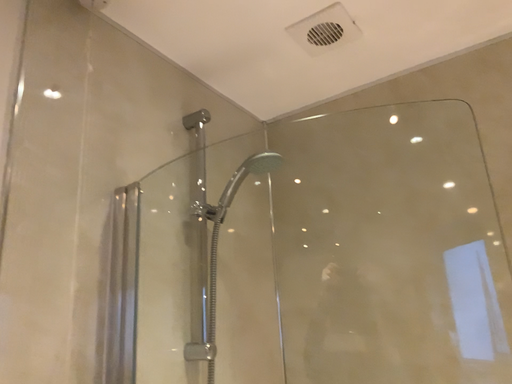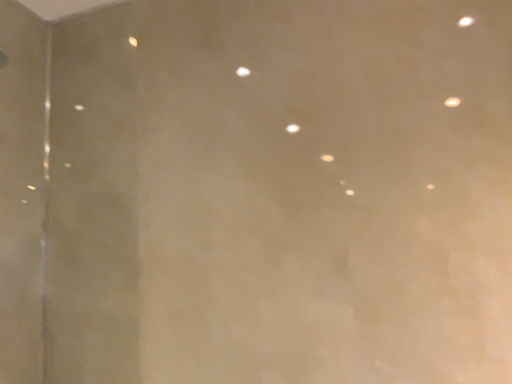
Question: Which way did the camera rotate in the video?

Choices:
 (A) rotated downward
 (B) rotated upward

Answer: (A)